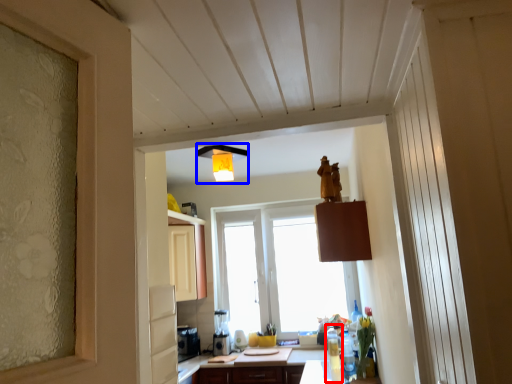
Question: Which object is further to the camera taking this photo, bottle (highlighted by a red box) or light fixture (highlighted by a blue box)?

Choices:
 (A) bottle
 (B) light fixture

Answer: (A)